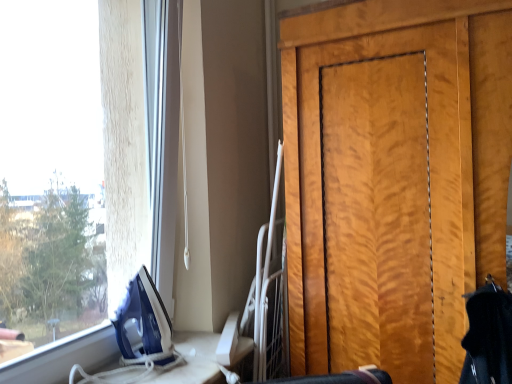
Question: Can you confirm if white plastic table at lower left is positioned to the left of wooden door at right?

Choices:
 (A) yes
 (B) no

Answer: (A)

Question: Could you tell me if white plastic table at lower left is facing wooden door at right?

Choices:
 (A) yes
 (B) no

Answer: (B)

Question: Can we say white plastic table at lower left lies outside wooden door at right?

Choices:
 (A) no
 (B) yes

Answer: (B)

Question: From the image's perspective, does white plastic table at lower left appear lower than wooden door at right?

Choices:
 (A) no
 (B) yes

Answer: (B)

Question: Can you confirm if white plastic table at lower left is wider than wooden door at right?

Choices:
 (A) no
 (B) yes

Answer: (A)

Question: Are white plastic table at lower left and wooden door at right located far from each other?

Choices:
 (A) no
 (B) yes

Answer: (A)

Question: Is wooden door at right to the left of white plastic table at lower left from the viewer's perspective?

Choices:
 (A) no
 (B) yes

Answer: (A)

Question: Is wooden door at right taller than white plastic table at lower left?

Choices:
 (A) no
 (B) yes

Answer: (B)

Question: Is wooden door at right at the right side of white plastic table at lower left?

Choices:
 (A) no
 (B) yes

Answer: (B)

Question: Considering the relative sizes of wooden door at right and white plastic table at lower left in the image provided, is wooden door at right thinner than white plastic table at lower left?

Choices:
 (A) yes
 (B) no

Answer: (B)

Question: Would you say white plastic table at lower left is part of wooden door at right's contents?

Choices:
 (A) yes
 (B) no

Answer: (B)

Question: Is wooden door at right facing towards white plastic table at lower left?

Choices:
 (A) no
 (B) yes

Answer: (A)

Question: Based on their sizes in the image, would you say white plastic table at lower left is bigger or smaller than wooden door at right?

Choices:
 (A) small
 (B) big

Answer: (A)